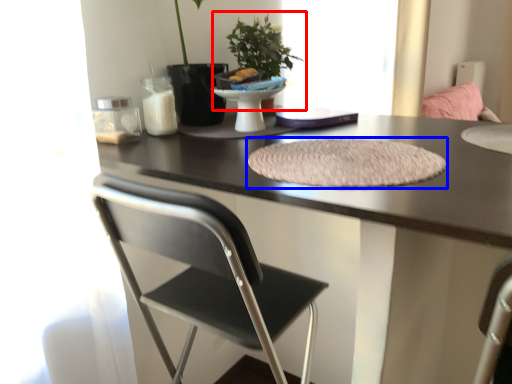
Question: Which object appears farthest to the camera in this image, houseplant (highlighted by a red box) or mat (highlighted by a blue box)?

Choices:
 (A) houseplant
 (B) mat

Answer: (A)